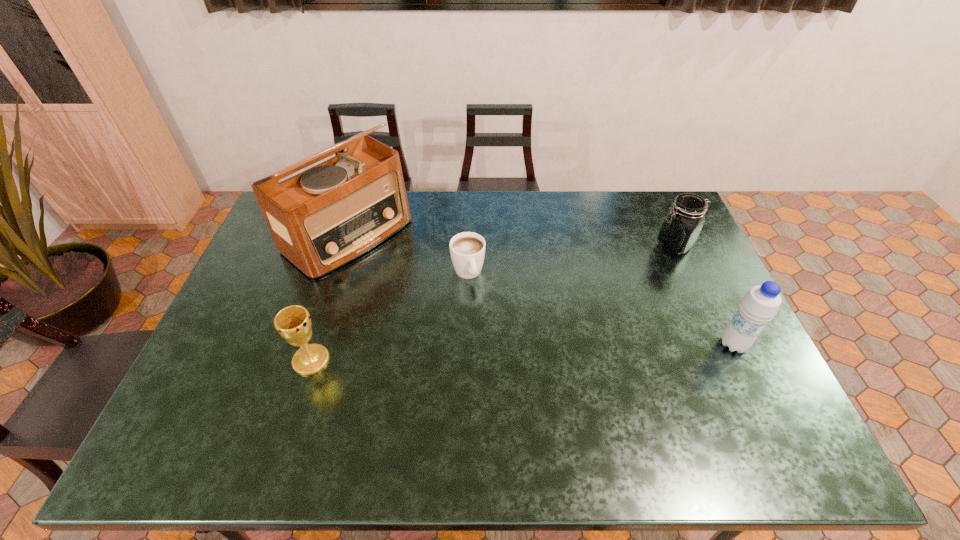
The width and height of the screenshot is (960, 540). In order to click on jar that is at the right edge in this screenshot , I will do `click(680, 229)`.

Find the location of a particular element. object that is positioned at the far left corner is located at coordinates (324, 217).

Where is `free space at the far edge of the desktop`? free space at the far edge of the desktop is located at coordinates (469, 227).

Image resolution: width=960 pixels, height=540 pixels. I want to click on free space at the near edge, so click(x=466, y=387).

In the image, there is a desktop. Where is `vacant region at the right edge`? This screenshot has width=960, height=540. vacant region at the right edge is located at coordinates (701, 281).

In the image, there is a desktop. Where is `vacant area at the far right corner`? The width and height of the screenshot is (960, 540). vacant area at the far right corner is located at coordinates (648, 210).

This screenshot has height=540, width=960. I want to click on vacant region at the near right corner, so click(718, 394).

Locate an element on the screen. This screenshot has width=960, height=540. unoccupied area between the jar and the cappuccino is located at coordinates (571, 259).

Find the location of a particular element. Image resolution: width=960 pixels, height=540 pixels. vacant space that's between the chalice and the radio receiver is located at coordinates (329, 298).

Locate an element on the screen. The image size is (960, 540). vacant area that lies between the water bottle and the jar is located at coordinates (704, 295).